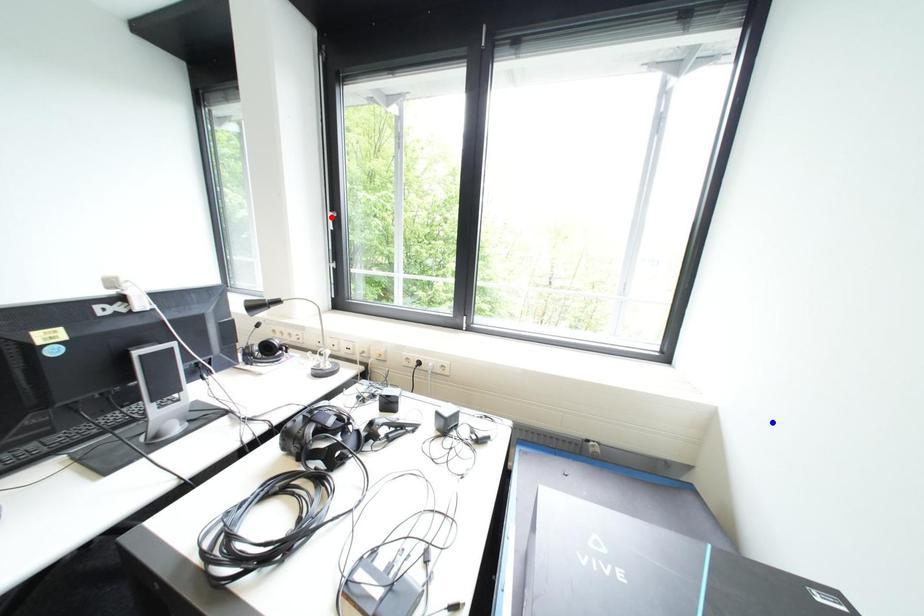
Question: Two points are marked on the image. Which point is closer to the camera?

Choices:
 (A) Blue point is closer.
 (B) Red point is closer.

Answer: (A)